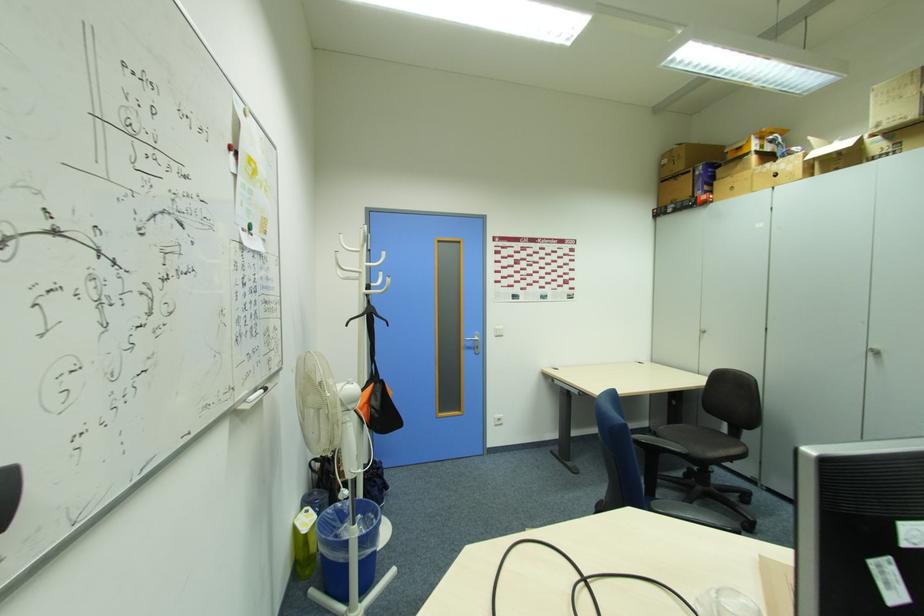
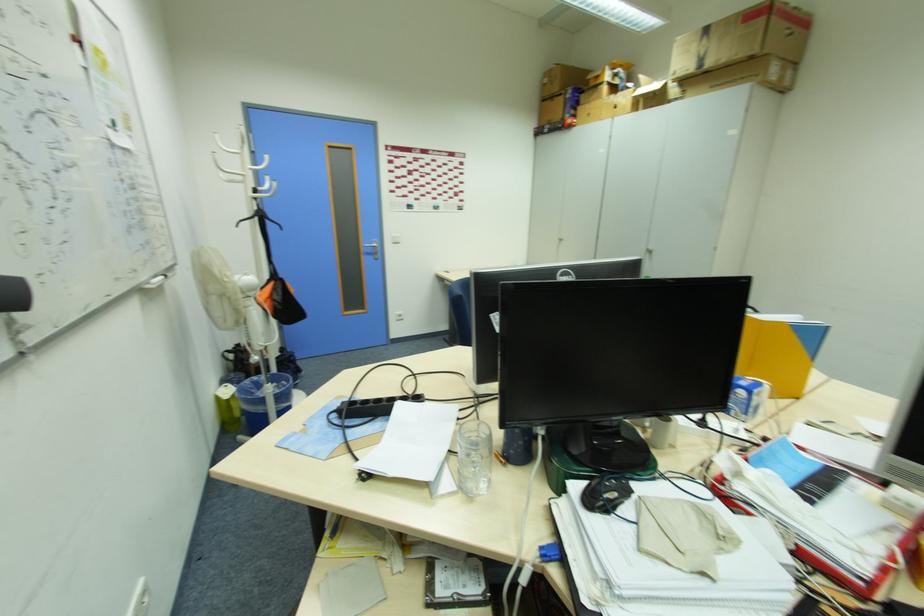
Find the pixel in the second image that matches [470,339] in the first image.

(370, 245)